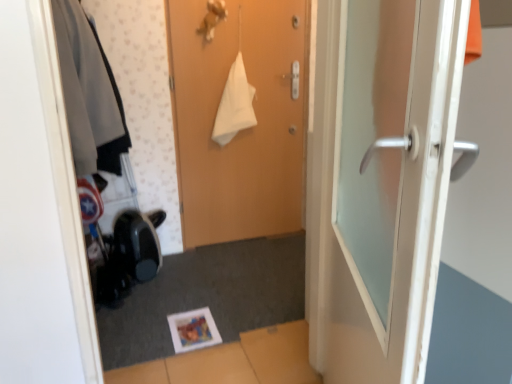
Question: Would you say wooden door at center, which is counted as the 2th door, starting from the front, is outside matte gray jacket at left?

Choices:
 (A) yes
 (B) no

Answer: (A)

Question: From a real-world perspective, is wooden door at center, which is counted as the 2th door, starting from the front, on top of matte gray jacket at left?

Choices:
 (A) yes
 (B) no

Answer: (B)

Question: Is wooden door at center, the first door in the back-to-front sequence, positioned far away from matte gray jacket at left?

Choices:
 (A) yes
 (B) no

Answer: (B)

Question: From the image's perspective, is wooden door at center, the first door in the back-to-front sequence, on top of matte gray jacket at left?

Choices:
 (A) yes
 (B) no

Answer: (B)

Question: Can you confirm if wooden door at center, the first door in the back-to-front sequence, is wider than matte gray jacket at left?

Choices:
 (A) yes
 (B) no

Answer: (B)

Question: Is white glossy door at right, the first door in the front-to-back sequence, inside the boundaries of wooden door at center, the first door in the back-to-front sequence, or outside?

Choices:
 (A) outside
 (B) inside

Answer: (A)

Question: From a real-world perspective, is white glossy door at right, the first door in the front-to-back sequence, above or below wooden door at center, the first door in the back-to-front sequence?

Choices:
 (A) above
 (B) below

Answer: (B)

Question: Considering their positions, is white glossy door at right, the first door in the front-to-back sequence, located in front of or behind wooden door at center, which is counted as the 2th door, starting from the front?

Choices:
 (A) front
 (B) behind

Answer: (A)

Question: Is point (368, 173) closer or farther from the camera than point (182, 31)?

Choices:
 (A) farther
 (B) closer

Answer: (B)

Question: From a real-world perspective, is white glossy door at right, the first door in the front-to-back sequence, physically located above or below matte gray jacket at left?

Choices:
 (A) above
 (B) below

Answer: (B)

Question: In the image, is white glossy door at right, arranged as the second door when viewed from the back, positioned in front of or behind matte gray jacket at left?

Choices:
 (A) behind
 (B) front

Answer: (B)

Question: Looking at the image, does white glossy door at right, arranged as the second door when viewed from the back, seem bigger or smaller compared to matte gray jacket at left?

Choices:
 (A) small
 (B) big

Answer: (B)

Question: Is white glossy door at right, arranged as the second door when viewed from the back, spatially inside matte gray jacket at left, or outside of it?

Choices:
 (A) inside
 (B) outside

Answer: (B)

Question: Is wooden door at center, which is counted as the 2th door, starting from the front, to the left or to the right of white glossy door at right, arranged as the second door when viewed from the back, in the image?

Choices:
 (A) left
 (B) right

Answer: (A)

Question: Is point (252, 231) closer or farther from the camera than point (336, 271)?

Choices:
 (A) closer
 (B) farther

Answer: (B)